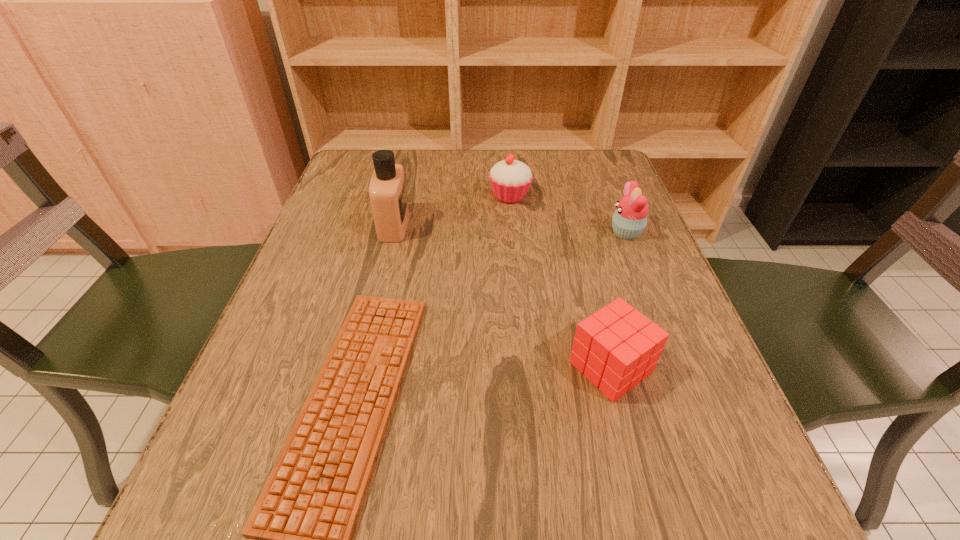
Where is `unoccupied area between the farther cupcake and the right cupcake`? This screenshot has width=960, height=540. unoccupied area between the farther cupcake and the right cupcake is located at coordinates click(x=568, y=214).

You are a GUI agent. You are given a task and a screenshot of the screen. Output one action in this format:
    pyautogui.click(x=<x>, y=<y>)
    Task: Click on the object that stands as the second closest to the shortest object
    The image size is (960, 540).
    Given the screenshot: What is the action you would take?
    click(616, 347)

Locate an element on the screen. This screenshot has height=540, width=960. the fourth closest object to the tallest object is located at coordinates point(630,218).

Locate an element on the screen. free location that satisfies the following two spatial constraints: 1. on the front side of the farthest object; 2. on the front label of the tallest object is located at coordinates (513, 225).

Find the location of a particular element. free space that satisfies the following two spatial constraints: 1. on the front label of the tallest object; 2. on the right side of the fourth tallest object is located at coordinates (360, 367).